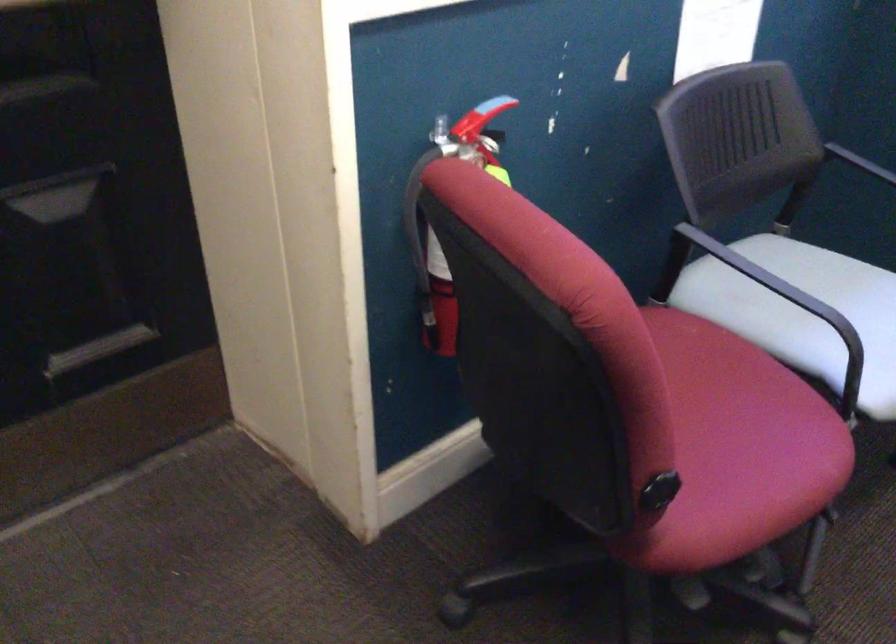
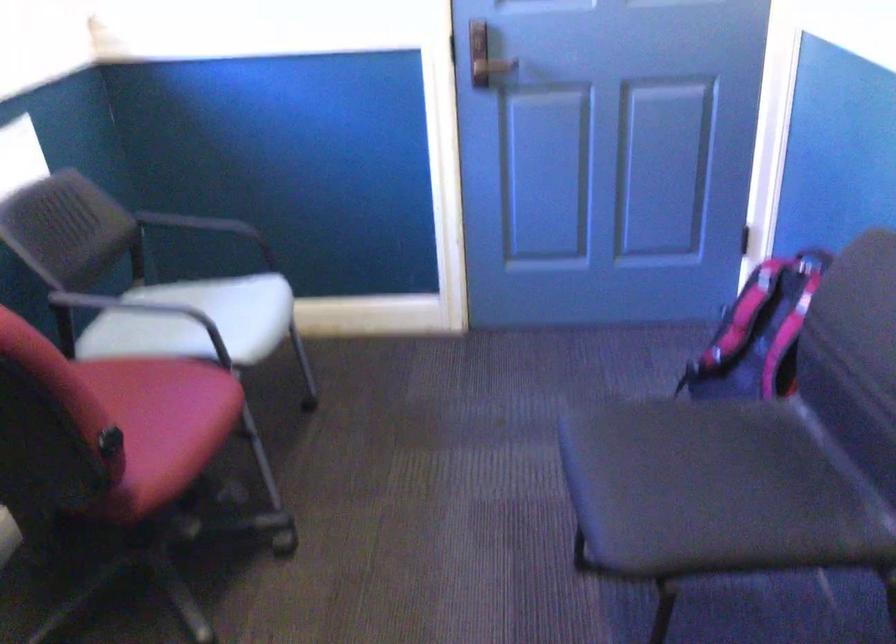
Find the pixel in the second image that matches point (755, 258) in the first image.

(135, 306)